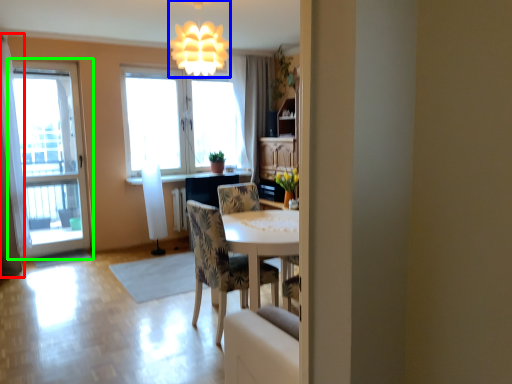
Question: Which is farther away from curtain (highlighted by a red box)? fixture (highlighted by a blue box) or window (highlighted by a green box)?

Choices:
 (A) fixture
 (B) window

Answer: (A)